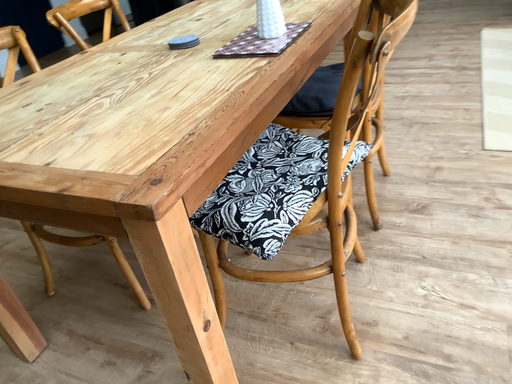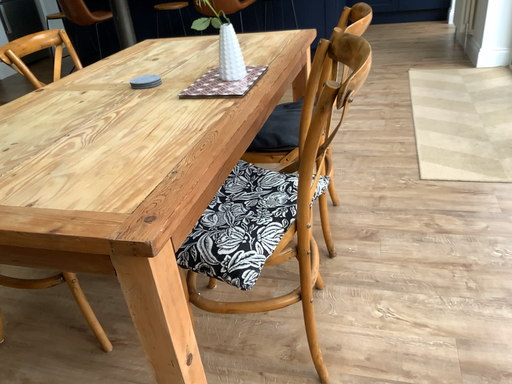
Question: Which way did the camera rotate in the video?

Choices:
 (A) rotated left
 (B) rotated right

Answer: (B)